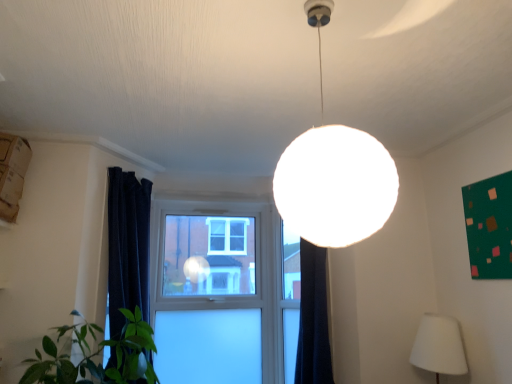
Question: Is green matte bulletin board at upper right oriented away from clear glass window at center?

Choices:
 (A) no
 (B) yes

Answer: (A)

Question: Does green matte bulletin board at upper right lie in front of clear glass window at center?

Choices:
 (A) no
 (B) yes

Answer: (B)

Question: From a real-world perspective, is green matte bulletin board at upper right physically below clear glass window at center?

Choices:
 (A) yes
 (B) no

Answer: (B)

Question: Is green matte bulletin board at upper right not close to clear glass window at center?

Choices:
 (A) yes
 (B) no

Answer: (A)

Question: Would you say green matte bulletin board at upper right is outside clear glass window at center?

Choices:
 (A) no
 (B) yes

Answer: (B)

Question: Is green matte bulletin board at upper right wider than clear glass window at center?

Choices:
 (A) yes
 (B) no

Answer: (B)

Question: Is green matte bulletin board at upper right at the left side of white fabric lampshade at lower right, arranged as the 2th lamp when viewed from the front?

Choices:
 (A) no
 (B) yes

Answer: (A)

Question: Would you consider green matte bulletin board at upper right to be distant from white fabric lampshade at lower right, the 1th lamp when ordered from right to left?

Choices:
 (A) no
 (B) yes

Answer: (A)

Question: From the image's perspective, is green matte bulletin board at upper right on white fabric lampshade at lower right, the 1th lamp when ordered from right to left?

Choices:
 (A) no
 (B) yes

Answer: (B)

Question: Can you confirm if green matte bulletin board at upper right is taller than white fabric lampshade at lower right, the 1th lamp when ordered from right to left?

Choices:
 (A) no
 (B) yes

Answer: (B)

Question: From a real-world perspective, is green matte bulletin board at upper right positioned over white fabric lampshade at lower right, arranged as the 2th lamp when viewed from the front, based on gravity?

Choices:
 (A) no
 (B) yes

Answer: (B)

Question: Would you say green matte bulletin board at upper right contains white fabric lampshade at lower right, the 1th lamp viewed from the back?

Choices:
 (A) yes
 (B) no

Answer: (B)

Question: Is clear glass window at center positioned with its back to green matte bulletin board at upper right?

Choices:
 (A) yes
 (B) no

Answer: (B)